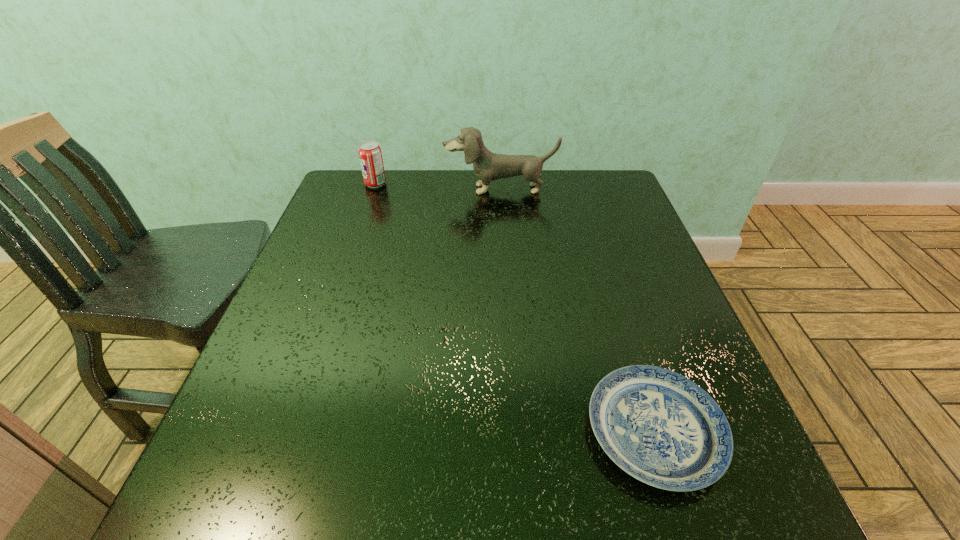
Identify the location of free space between the tallest object and the shortest object. (577, 310).

The width and height of the screenshot is (960, 540). Find the location of `the closest object relative to the leftmost object`. the closest object relative to the leftmost object is located at coordinates (488, 166).

Identify which object is the nearest to the shortest object. Please provide its 2D coordinates. Your answer should be formatted as a tuple, i.e. [(x, y)], where the tuple contains the x and y coordinates of a point satisfying the conditions above.

[(488, 166)]

Where is `vacant area in the image that satisfies the following two spatial constraints: 1. at the face of the tallest object; 2. on the right side of the nearest object`? This screenshot has height=540, width=960. vacant area in the image that satisfies the following two spatial constraints: 1. at the face of the tallest object; 2. on the right side of the nearest object is located at coordinates (516, 431).

Find the location of a particular element. This screenshot has height=540, width=960. free point that satisfies the following two spatial constraints: 1. at the face of the puppy; 2. on the right side of the plate is located at coordinates (516, 431).

This screenshot has height=540, width=960. I want to click on vacant space that satisfies the following two spatial constraints: 1. at the face of the shortest object; 2. on the right side of the tallest object, so click(516, 431).

Identify the location of vacant position in the image that satisfies the following two spatial constraints: 1. at the face of the puppy; 2. on the left side of the plate. (516, 431).

At what (x,y) coordinates should I click in order to perform the action: click on vacant area that satisfies the following two spatial constraints: 1. on the front side of the nearest object; 2. on the right side of the second tallest object. Please return your answer as a coordinate pair (x, y). This screenshot has width=960, height=540. Looking at the image, I should click on coord(291,431).

Locate an element on the screen. This screenshot has width=960, height=540. free space that satisfies the following two spatial constraints: 1. at the face of the tallest object; 2. on the left side of the nearest object is located at coordinates [516, 431].